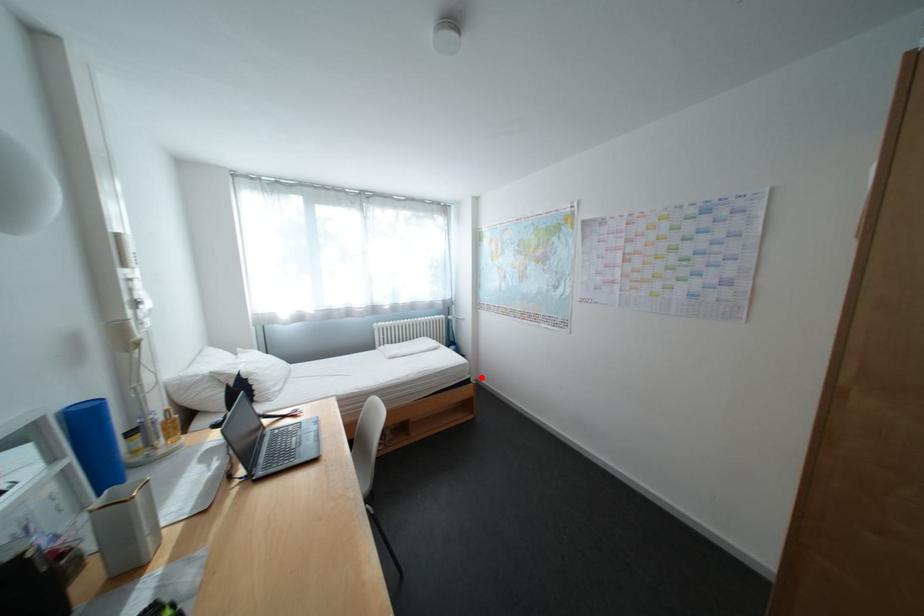
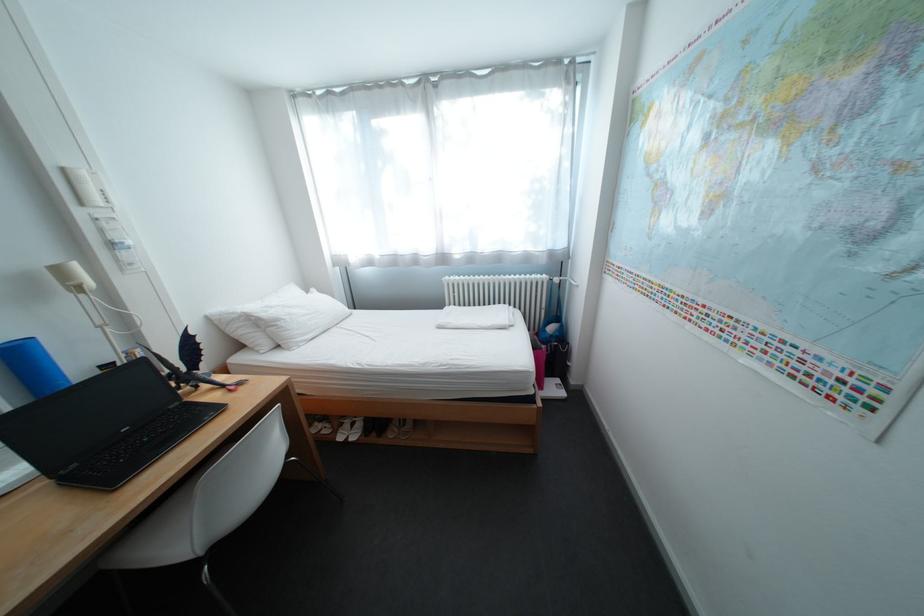
Find the pixel in the second image that matches the highlighted location in the first image.

(544, 392)